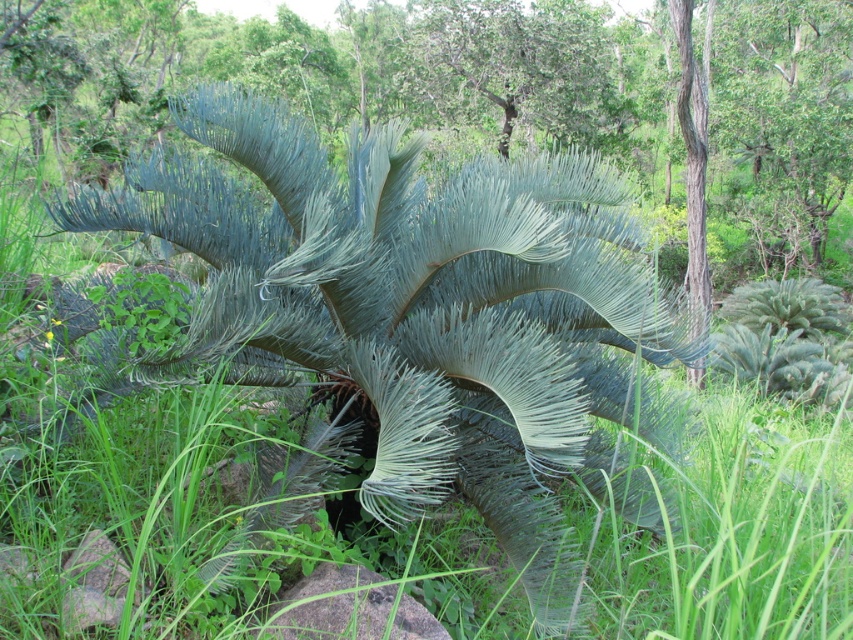
You are a botanist examining the green fibrous fern at center and the gray rock at center in a tropical forest. Which object occupies more horizontal space in the image?

The green fibrous fern at center has a greater width than the gray rock at center, so it occupies more horizontal space in the image.

What are the coordinates of the green fibrous fern at center?

The green fibrous fern at center is located at coordinates point (x=416, y=320).